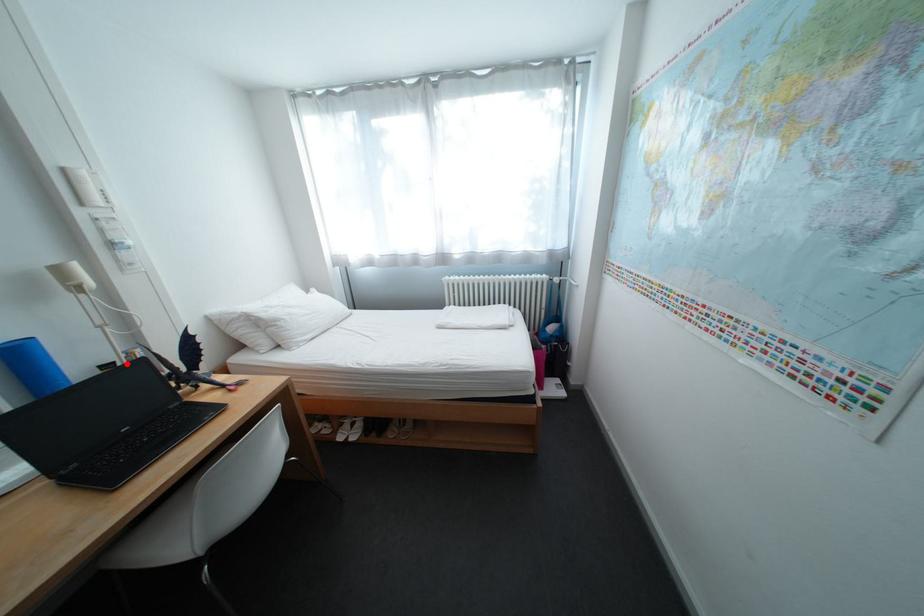
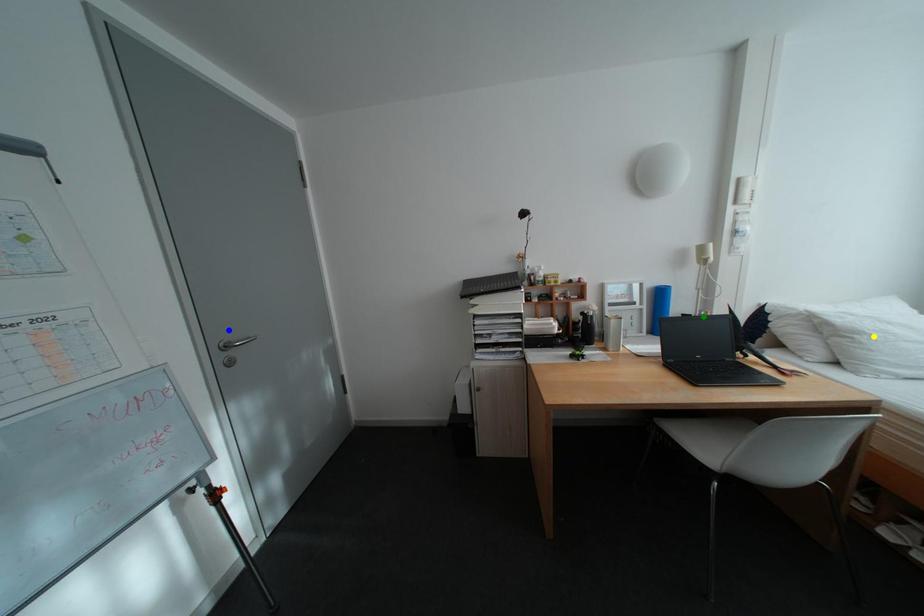
Question: I am providing you with two images of the same scene from different viewpoints. A red point is marked on the first image. You are given multiple points on the second image. In image 2, which mark is for the same physical point as the one in image 1?

Choices:
 (A) yellow point
 (B) blue point
 (C) green point

Answer: (C)